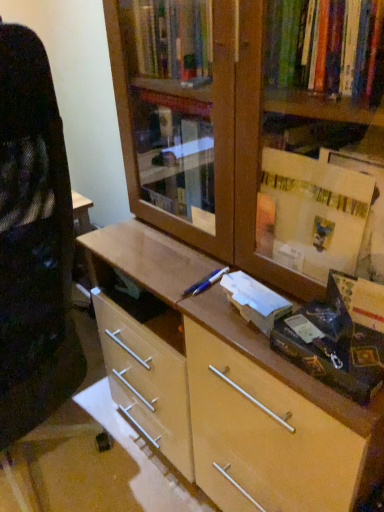
Describe the element at coordinates (205, 282) in the screenshot. I see `blue metallic pen at center` at that location.

The height and width of the screenshot is (512, 384). I want to click on blue metallic pen at center, so click(x=205, y=282).

This screenshot has width=384, height=512. What do you see at coordinates (255, 300) in the screenshot?
I see `white paper at center` at bounding box center [255, 300].

Locate an element on the screen. white paper at center is located at coordinates (255, 300).

The image size is (384, 512). In order to click on blue metallic pen at center in this screenshot , I will do `click(205, 282)`.

Considering the relative positions of blue metallic pen at center and white paper at center in the image provided, is blue metallic pen at center to the right of white paper at center from the viewer's perspective?

In fact, blue metallic pen at center is to the left of white paper at center.

In the scene shown: Is blue metallic pen at center closer to the viewer compared to white paper at center?

No, the depth of blue metallic pen at center is greater than that of white paper at center.

Is point (206, 282) farther from viewer compared to point (273, 307)?

Yes, it is behind point (273, 307).

From the image's perspective, between blue metallic pen at center and white paper at center, which one is located above?

From the image's view, blue metallic pen at center is above.

From a real-world perspective, between blue metallic pen at center and white paper at center, who is vertically lower?

blue metallic pen at center is physically lower.

Considering the sizes of blue metallic pen at center and white paper at center in the image, is blue metallic pen at center wider or thinner than white paper at center?

Clearly, blue metallic pen at center has more width compared to white paper at center.

Which of these two, blue metallic pen at center or white paper at center, stands taller?

Standing taller between the two is white paper at center.

Is blue metallic pen at center smaller than white paper at center?

Yes, blue metallic pen at center is smaller than white paper at center.

Is blue metallic pen at center outside of white paper at center?

That's correct, blue metallic pen at center is outside of white paper at center.

Is blue metallic pen at center directly adjacent to white paper at center?

No, blue metallic pen at center is not next to white paper at center.

Is blue metallic pen at center facing towards white paper at center?

No, blue metallic pen at center is not facing towards white paper at center.

How different are the orientations of blue metallic pen at center and white paper at center in degrees?

The angular difference between blue metallic pen at center and white paper at center is 11.9 degrees.

Where is `book located above the blue metallic pen at center (from a real-world perspective)`? This screenshot has width=384, height=512. book located above the blue metallic pen at center (from a real-world perspective) is located at coordinates (255, 300).

Does white paper at center appear on the left side of blue metallic pen at center?

Incorrect, white paper at center is not on the left side of blue metallic pen at center.

Is white paper at center positioned in front of blue metallic pen at center?

Yes, it is in front of blue metallic pen at center.

Which is less distant, (289, 309) or (207, 284)?

Point (289, 309).

From the image's perspective, which one is positioned higher, white paper at center or blue metallic pen at center?

blue metallic pen at center appears higher in the image.

From a real-world perspective, which is physically below, white paper at center or blue metallic pen at center?

blue metallic pen at center is physically lower.

Between white paper at center and blue metallic pen at center, which one has smaller width?

white paper at center.

Does white paper at center have a greater height compared to blue metallic pen at center?

Indeed, white paper at center has a greater height compared to blue metallic pen at center.

Is white paper at center bigger than blue metallic pen at center?

Correct, white paper at center is larger in size than blue metallic pen at center.

Is white paper at center located outside blue metallic pen at center?

Indeed, white paper at center is completely outside blue metallic pen at center.

Is white paper at center positioned far away from blue metallic pen at center?

Actually, white paper at center and blue metallic pen at center are a little close together.

In the scene shown: Does white paper at center turn towards blue metallic pen at center?

No, white paper at center is not turned towards blue metallic pen at center.

How different are the orientations of white paper at center and blue metallic pen at center in degrees?

white paper at center and blue metallic pen at center are facing 11.9 degrees away from each other.

How far apart are white paper at center and blue metallic pen at center?

white paper at center is 4.08 inches away from blue metallic pen at center.

This screenshot has height=512, width=384. What are the coordinates of `book on the right of blue metallic pen at center` in the screenshot? It's located at (255, 300).

Find the location of a particular element. The width and height of the screenshot is (384, 512). book located below the blue metallic pen at center (from the image's perspective) is located at coordinates (255, 300).

I want to click on pen beneath the white paper at center (from a real-world perspective), so click(205, 282).